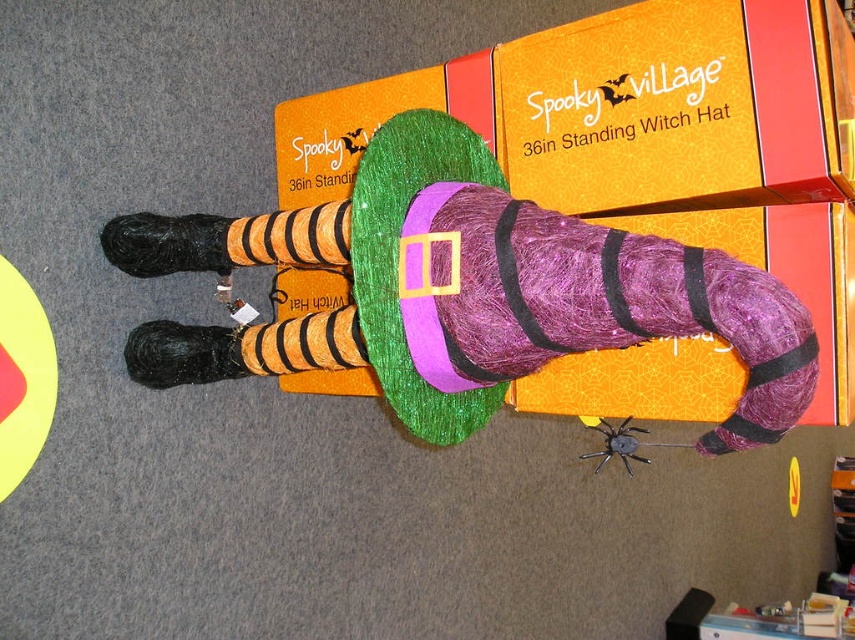
Question: Which point appears farthest from the camera in this image?

Choices:
 (A) (476, 256)
 (B) (673, 444)
 (C) (317, 131)

Answer: (B)

Question: Does purple glittery witch hat at center appear on the right side of black matte spider at center?

Choices:
 (A) no
 (B) yes

Answer: (A)

Question: Which point is farther to the camera?

Choices:
 (A) (211, 356)
 (B) (612, 432)

Answer: (B)

Question: Does purple glittery witch hat at center lie in front of green glittery witch hat at center?

Choices:
 (A) yes
 (B) no

Answer: (A)

Question: Does purple glittery witch hat at center have a larger size compared to black matte spider at center?

Choices:
 (A) no
 (B) yes

Answer: (A)

Question: Which point is farther to the camera?

Choices:
 (A) green glittery witch hat at center
 (B) purple glittery witch hat at center
 (C) black matte spider at center

Answer: (A)